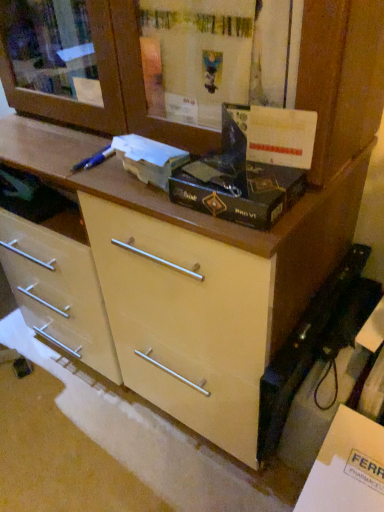
Question: Considering the positions of white cardboard box at center, which appears as the second box when viewed from the right, and black matte box at center, which ranks as the 1th box in right-to-left order, in the image, is white cardboard box at center, which appears as the second box when viewed from the right, wider or thinner than black matte box at center, which ranks as the 1th box in right-to-left order,?

Choices:
 (A) wide
 (B) thin

Answer: (B)

Question: Is white cardboard box at center, which appears as the second box when viewed from the right, taller or shorter than black matte box at center, which ranks as the 1th box in right-to-left order?

Choices:
 (A) short
 (B) tall

Answer: (B)

Question: Which object is positioned closest to the white cardboard box at center, acting as the first box starting from the left?

Choices:
 (A) black matte box at center, arranged as the 2th box when viewed from the left
 (B) white matte cabinet at lower right

Answer: (A)

Question: Considering the real-world distances, which object is closest to the black matte box at center, which ranks as the 1th box in right-to-left order?

Choices:
 (A) white cardboard box at center, which appears as the second box when viewed from the right
 (B) white matte cabinet at lower right

Answer: (A)